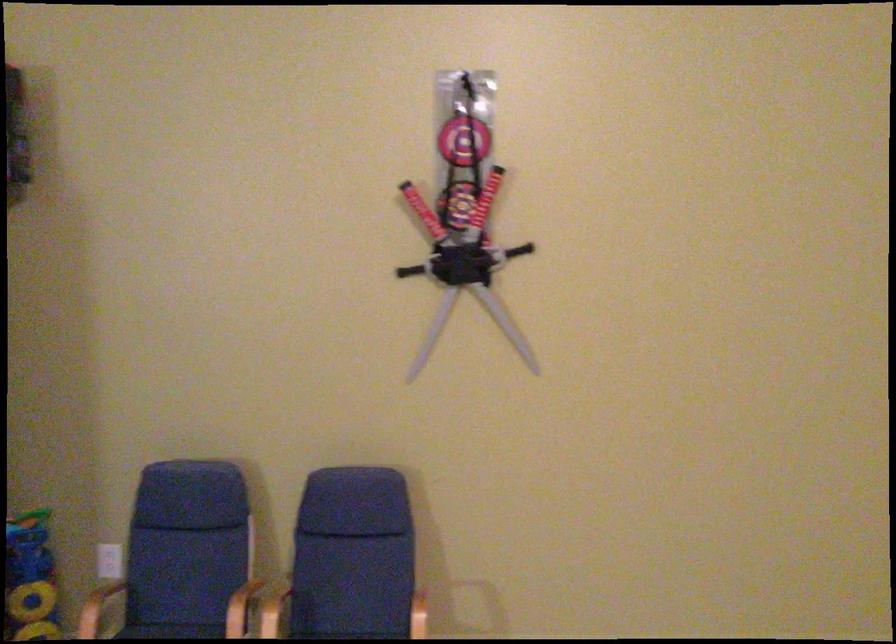
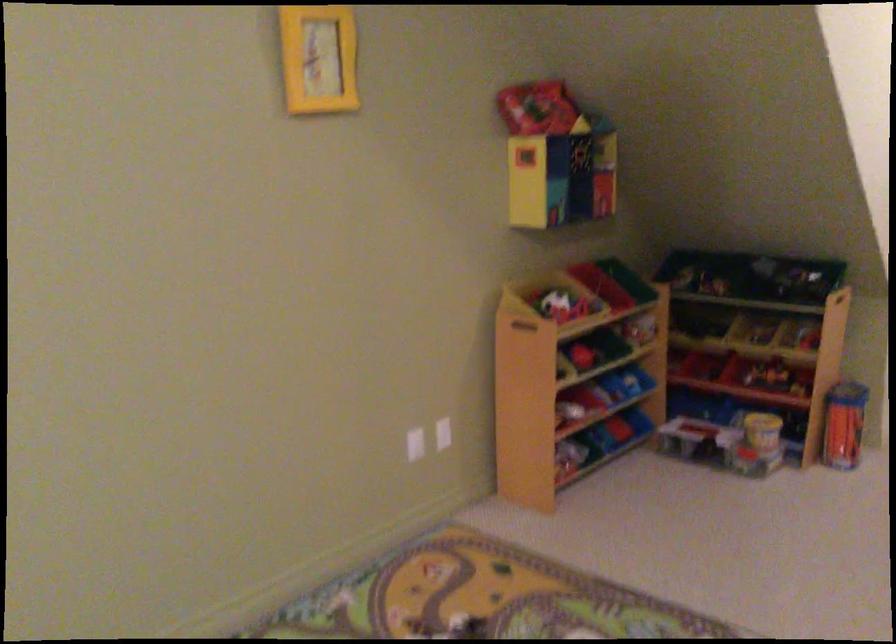
Question: The camera is either moving clockwise (left) or counter-clockwise (right) around the object. The first image is from the beginning of the video and the second image is from the end. Is the camera moving left or right when shooting the video?

Choices:
 (A) Left
 (B) Right

Answer: (A)